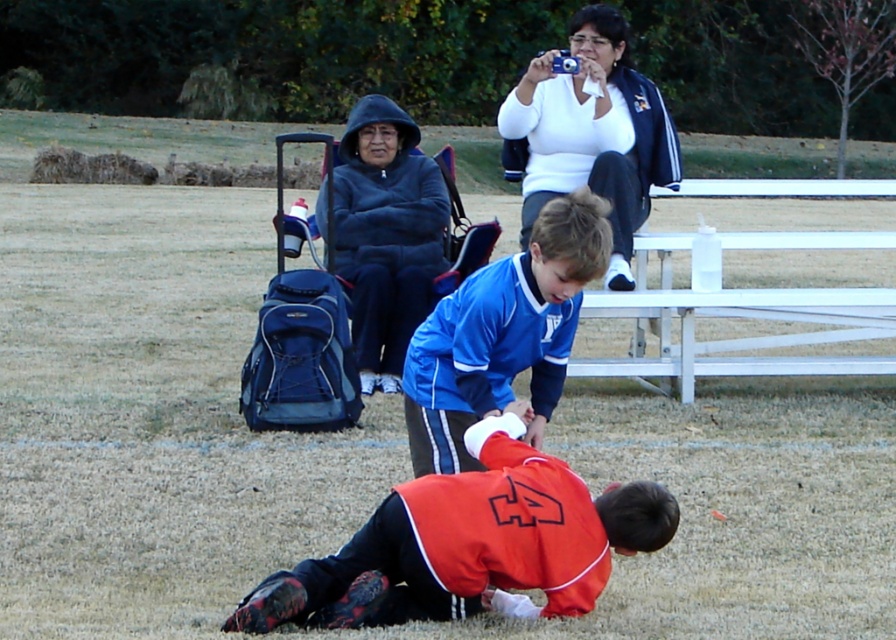
Does orange jersey at lower center appear on the right side of dark blue hoodie at upper center?

Correct, you'll find orange jersey at lower center to the right of dark blue hoodie at upper center.

Between orange jersey at lower center and dark blue hoodie at upper center, which one has less height?

With less height is orange jersey at lower center.

This screenshot has height=640, width=896. What are the coordinates of `orange jersey at lower center` in the screenshot? It's located at (471, 545).

The image size is (896, 640). I want to click on orange jersey at lower center, so click(471, 545).

Does blue synthetic jersey at center have a larger size compared to dark blue hoodie at upper center?

No.

Which is in front, point (549, 280) or point (316, 216)?

Point (549, 280) is more forward.

Between point (562, 224) and point (375, 310), which one is positioned in front?

Point (562, 224)

You are a GUI agent. You are given a task and a screenshot of the screen. Output one action in this format:
    pyautogui.click(x=<x>, y=<y>)
    Task: Click on the blue synthetic jersey at center
    This screenshot has width=896, height=640.
    Given the screenshot: What is the action you would take?
    pyautogui.click(x=502, y=333)

Who is shorter, orange jersey at lower center or blue synthetic jersey at center?

orange jersey at lower center is shorter.

Between orange jersey at lower center and blue synthetic jersey at center, which one is positioned higher?

Positioned higher is blue synthetic jersey at center.

Image resolution: width=896 pixels, height=640 pixels. Identify the location of orange jersey at lower center. (471, 545).